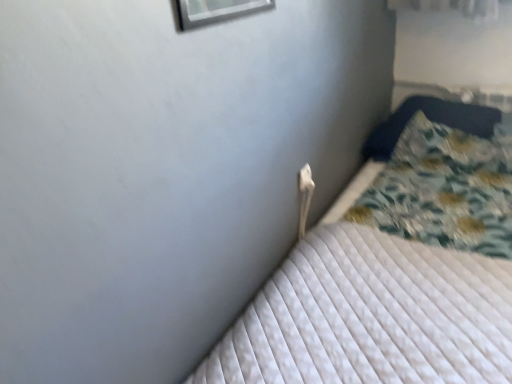
Question: Is fluffy blue pillow at right not near white quilted mattress at center?

Choices:
 (A) yes
 (B) no

Answer: (B)

Question: From a real-world perspective, is fluffy blue pillow at right positioned under white quilted mattress at center based on gravity?

Choices:
 (A) yes
 (B) no

Answer: (B)

Question: Does fluffy blue pillow at right have a greater width compared to white quilted mattress at center?

Choices:
 (A) yes
 (B) no

Answer: (B)

Question: From the image's perspective, is fluffy blue pillow at right beneath white quilted mattress at center?

Choices:
 (A) no
 (B) yes

Answer: (A)

Question: From the image's perspective, would you say fluffy blue pillow at right is positioned over white quilted mattress at center?

Choices:
 (A) yes
 (B) no

Answer: (A)

Question: Does fluffy blue pillow at right lie in front of white quilted mattress at center?

Choices:
 (A) no
 (B) yes

Answer: (A)

Question: Is white quilted mattress at center to the left of fluffy blue pillow at right from the viewer's perspective?

Choices:
 (A) yes
 (B) no

Answer: (A)

Question: Would you say white quilted mattress at center is a long distance from fluffy blue pillow at right?

Choices:
 (A) no
 (B) yes

Answer: (A)

Question: Is white quilted mattress at center outside fluffy blue pillow at right?

Choices:
 (A) yes
 (B) no

Answer: (A)

Question: From a real-world perspective, is white quilted mattress at center located beneath fluffy blue pillow at right?

Choices:
 (A) no
 (B) yes

Answer: (B)

Question: Considering the relative sizes of white quilted mattress at center and fluffy blue pillow at right in the image provided, is white quilted mattress at center shorter than fluffy blue pillow at right?

Choices:
 (A) yes
 (B) no

Answer: (B)

Question: From a real-world perspective, does white quilted mattress at center stand above fluffy blue pillow at right?

Choices:
 (A) yes
 (B) no

Answer: (B)

Question: From the image's perspective, is white plastic electric outlet at upper center above white quilted mattress at center?

Choices:
 (A) yes
 (B) no

Answer: (A)